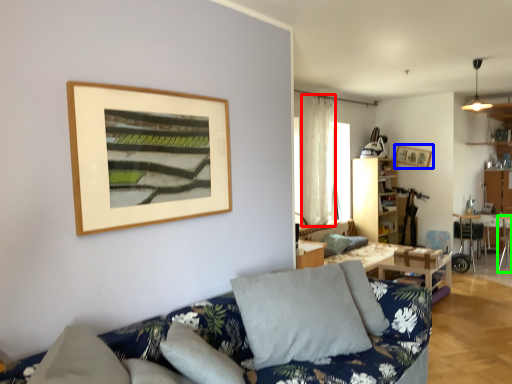
Question: Which object is positioned closest to curtain (highlighted by a red box)? Select from picture frame (highlighted by a blue box) and armchair (highlighted by a green box).

Choices:
 (A) picture frame
 (B) armchair

Answer: (A)